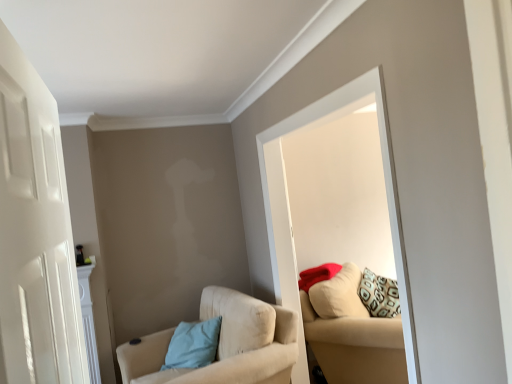
Question: In terms of height, does white glossy mirror at upper center look taller or shorter compared to light blue fabric pillow at lower left, which is the first pillow from left to right?

Choices:
 (A) tall
 (B) short

Answer: (A)

Question: Is point (290, 127) positioned closer to the camera than point (203, 322)?

Choices:
 (A) closer
 (B) farther

Answer: (A)

Question: Estimate the real-world distances between objects in this image. Which object is farther from the white glossy mirror at upper center?

Choices:
 (A) white matte door at left
 (B) matte red pillow at upper right, marked as the 1th pillow in a right-to-left arrangement
 (C) beige fabric chair at lower left
 (D) light blue fabric pillow at lower left, the 1th pillow in the bottom-to-top sequence
 (E) beige fabric couch at right

Answer: (A)

Question: Estimate the real-world distances between objects in this image. Which object is farther from the matte red pillow at upper right, marked as the 2th pillow in a left-to-right arrangement?

Choices:
 (A) white glossy mirror at upper center
 (B) beige fabric chair at lower left
 (C) light blue fabric pillow at lower left, which is the first pillow from left to right
 (D) beige fabric couch at right
 (E) white matte door at left

Answer: (E)